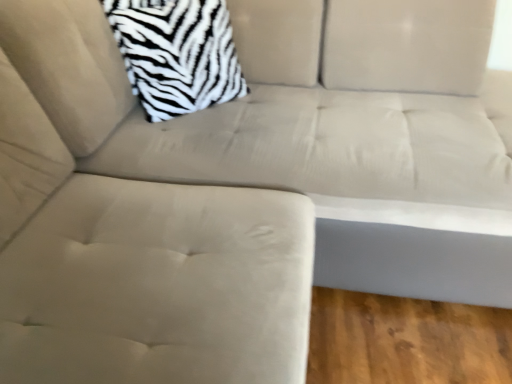
Question: From their relative heights in the image, would you say suede beige swivel chair at center is taller or shorter than zebra-patterned fabric pillow at upper left?

Choices:
 (A) tall
 (B) short

Answer: (A)

Question: From a real-world perspective, relative to zebra-patterned fabric pillow at upper left, is suede beige swivel chair at center vertically above or below?

Choices:
 (A) above
 (B) below

Answer: (B)

Question: Is suede beige swivel chair at center to the left or to the right of zebra-patterned fabric pillow at upper left in the image?

Choices:
 (A) left
 (B) right

Answer: (A)

Question: From a real-world perspective, is zebra-patterned fabric pillow at upper left physically located above or below suede beige swivel chair at center?

Choices:
 (A) below
 (B) above

Answer: (B)

Question: Relative to suede beige swivel chair at center, is zebra-patterned fabric pillow at upper left in front or behind?

Choices:
 (A) front
 (B) behind

Answer: (B)

Question: Considering the positions of point (169, 71) and point (96, 382), is point (169, 71) closer or farther from the camera than point (96, 382)?

Choices:
 (A) farther
 (B) closer

Answer: (A)

Question: From the image's perspective, is zebra-patterned fabric pillow at upper left positioned above or below suede beige swivel chair at center?

Choices:
 (A) above
 (B) below

Answer: (A)